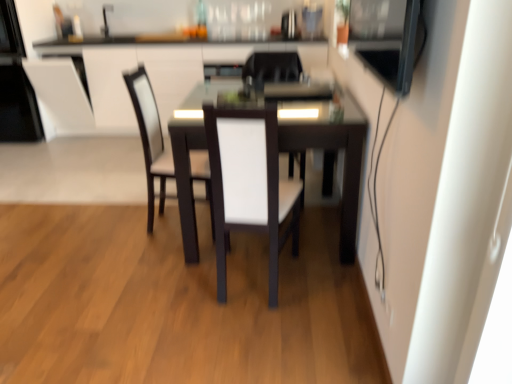
Question: From their relative heights in the image, would you say black glossy microwave at upper left, marked as the 3th appliance in a right-to-left arrangement, is taller or shorter than satin black refrigerator at upper center, the 3th appliance in the front-to-back sequence?

Choices:
 (A) tall
 (B) short

Answer: (A)

Question: From the image's perspective, relative to satin black refrigerator at upper center, positioned as the 2th appliance in left-to-right order, is black glossy microwave at upper left, which is the 2th appliance in front-to-back order, above or below?

Choices:
 (A) below
 (B) above

Answer: (A)

Question: Which is nearer to the black glossy microwave at upper left, marked as the 3th appliance in a right-to-left arrangement?

Choices:
 (A) white leather chair at center, which is the second chair in back-to-front order
 (B) satin black refrigerator at upper center, arranged as the first appliance when viewed from the back
 (C) matte black table at center
 (D) white fabric chair at center, marked as the first chair in a front-to-back arrangement
 (E) white fabric chair at center, the third chair in the front-to-back sequence

Answer: (C)

Question: Which of these objects is positioned farthest from the satin black refrigerator at upper center, which ranks as the 2th appliance in right-to-left order?

Choices:
 (A) white fabric chair at center, which is the 3th chair from back to front
 (B) matte black table at center
 (C) white leather chair at center, which ranks as the 2th chair in front-to-back order
 (D) dark wood table at center
 (E) white fabric chair at center, marked as the 1th chair in a back-to-front arrangement

Answer: (A)